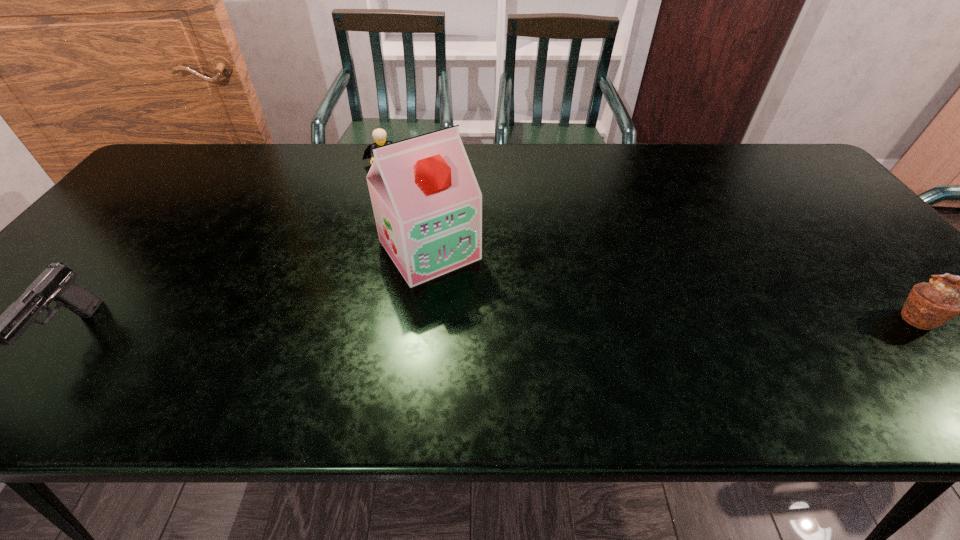
I want to click on free point between the tallest object and the rightmost object, so click(673, 284).

Where is `the second closest object relative to the rightmost object`? The height and width of the screenshot is (540, 960). the second closest object relative to the rightmost object is located at coordinates (379, 135).

In order to click on object that is the closest to the pistol in this screenshot , I will do `click(427, 204)`.

You are a GUI agent. You are given a task and a screenshot of the screen. Output one action in this format:
    pyautogui.click(x=<x>, y=<y>)
    Task: Click on the free space that satisfies the following two spatial constraints: 1. on the front side of the farthest object; 2. on the right side of the tallest object
    This screenshot has height=540, width=960.
    Given the screenshot: What is the action you would take?
    pyautogui.click(x=357, y=249)

In order to click on vacant area in the image that satisfies the following two spatial constraints: 1. on the front side of the rightmost object; 2. on the left side of the third nearest object in this screenshot , I will do `click(421, 318)`.